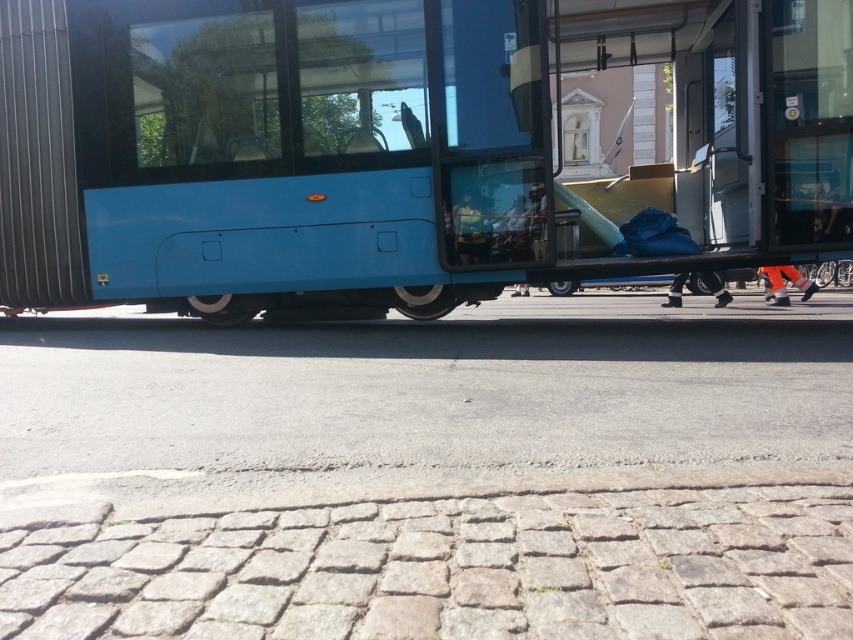
Question: Among these points, which one is nearest to the camera?

Choices:
 (A) (792, 275)
 (B) (494, 141)

Answer: (B)

Question: Which object appears farthest from the camera in this image?

Choices:
 (A) orange fabric pants at lower right
 (B) gray asphalt at center

Answer: (A)

Question: Does gray asphalt at center have a larger size compared to blue matte bus at center?

Choices:
 (A) no
 (B) yes

Answer: (A)

Question: Which point is closer to the camera?

Choices:
 (A) blue matte bus at center
 (B) orange fabric pants at lower right

Answer: (A)

Question: Is blue matte bus at center above orange fabric pants at lower right?

Choices:
 (A) yes
 (B) no

Answer: (A)

Question: Can you confirm if gray asphalt at center is thinner than orange fabric pants at lower right?

Choices:
 (A) yes
 (B) no

Answer: (A)